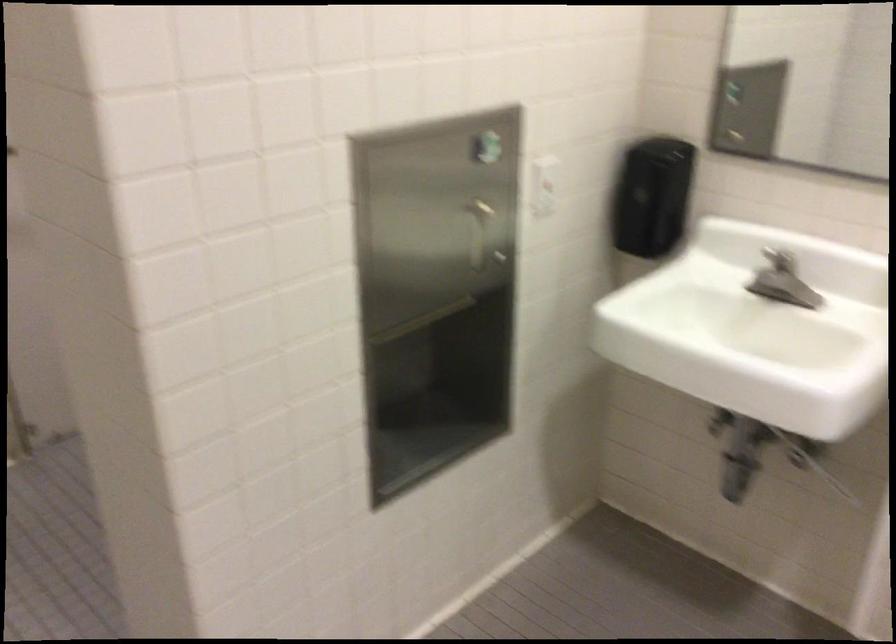
Identify the location of white light switch. (543, 185).